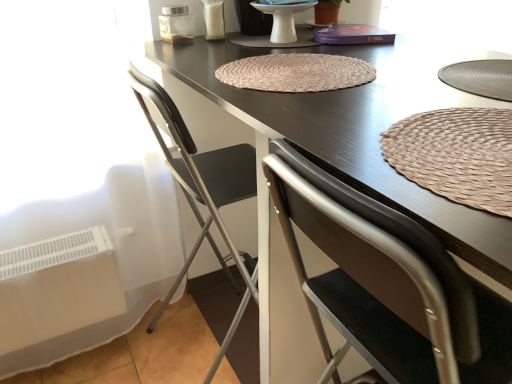
What do you see at coordinates (283, 20) in the screenshot?
I see `matte ceramic plate at center` at bounding box center [283, 20].

At what (x,y) coordinates should I click in order to perform the action: click on metallic gray chair at left. Please return your answer as a coordinate pair (x, y). Image resolution: width=512 pixels, height=384 pixels. Looking at the image, I should click on (203, 191).

Which is in front, brown woven mat at center, arranged as the 2th mat when viewed from the top, or dark brown wood table at center?

Positioned in front is dark brown wood table at center.

Is brown woven mat at center, which is the 1th mat from bottom to top, oriented away from dark brown wood table at center?

Correct, brown woven mat at center, which is the 1th mat from bottom to top, is looking away from dark brown wood table at center.

In terms of height, does brown woven mat at center, which is the 1th mat from bottom to top, look taller or shorter compared to dark brown wood table at center?

In the image, brown woven mat at center, which is the 1th mat from bottom to top, appears to be shorter than dark brown wood table at center.

Is brown woven mat at center, arranged as the 2th mat when viewed from the top, oriented away from matte ceramic plate at center?

No, brown woven mat at center, arranged as the 2th mat when viewed from the top,'s orientation is not away from matte ceramic plate at center.

How many degrees apart are the facing directions of brown woven mat at center, which is the 1th mat from bottom to top, and matte ceramic plate at center?

The facing directions of brown woven mat at center, which is the 1th mat from bottom to top, and matte ceramic plate at center are 2.3e-05 degrees apart.

Where is `round table behind the brown woven mat at center, which is the first mat from front to back`? Image resolution: width=512 pixels, height=384 pixels. round table behind the brown woven mat at center, which is the first mat from front to back is located at coordinates (283, 20).

In terms of size, does brown woven mat at center, which is the 1th mat from bottom to top, appear bigger or smaller than matte ceramic plate at center?

Clearly, brown woven mat at center, which is the 1th mat from bottom to top, is smaller in size than matte ceramic plate at center.

Does point (199, 67) come in front of point (276, 79)?

No.

From a real-world perspective, count 2nd mats upward from the dark brown wood table at center and point to it. Please provide its 2D coordinates.

[(296, 72)]

Could you tell me if dark brown wood table at center is facing brown woven mat at center, placed as the first mat when sorted from back to front?

No, dark brown wood table at center does not turn towards brown woven mat at center, placed as the first mat when sorted from back to front.

Considering the relative sizes of dark brown wood table at center and brown woven mat at center, placed as the first mat when sorted from back to front, in the image provided, is dark brown wood table at center smaller than brown woven mat at center, placed as the first mat when sorted from back to front,?

No, dark brown wood table at center is not smaller than brown woven mat at center, placed as the first mat when sorted from back to front.

Is dark brown wood table at center with metallic gray chair at left?

No.

Who is more distant, dark brown wood table at center or metallic gray chair at left?

metallic gray chair at left is behind.

Is dark brown wood table at center not within metallic gray chair at left?

dark brown wood table at center lies outside metallic gray chair at left's area.

Can you confirm if dark brown wood table at center is smaller than metallic gray chair at left?

Incorrect, dark brown wood table at center is not smaller in size than metallic gray chair at left.

Is point (286, 29) positioned behind point (242, 86)?

Yes, point (286, 29) is farther from viewer.

In the scene shown: Can you confirm if matte ceramic plate at center is shorter than brown woven mat at center, the second mat ordered from the bottom?

No, matte ceramic plate at center is not shorter than brown woven mat at center, the second mat ordered from the bottom.

Is matte ceramic plate at center far away from brown woven mat at center, placed as the first mat when sorted from back to front?

No, matte ceramic plate at center is not far from brown woven mat at center, placed as the first mat when sorted from back to front.

Between matte ceramic plate at center and brown woven mat at center, arranged as the first mat when viewed from the top, which one has smaller width?

Thinner between the two is matte ceramic plate at center.

From a real-world perspective, is matte ceramic plate at center under metallic gray chair at left?

No, from a real-world perspective, matte ceramic plate at center is not under metallic gray chair at left.

Is matte ceramic plate at center oriented towards metallic gray chair at left?

No.

Which is in front, matte ceramic plate at center or metallic gray chair at left?

metallic gray chair at left is closer to the camera.

Is matte ceramic plate at center at the left side of metallic gray chair at left?

No.

Does metallic gray chair at left turn towards matte ceramic plate at center?

Yes, metallic gray chair at left is oriented towards matte ceramic plate at center.

In the scene shown: Is metallic gray chair at left behind matte ceramic plate at center?

That is False.

Which point is more forward, (213, 188) or (292, 19)?

Point (213, 188)

Considering the positions of objects metallic gray chair at left and matte ceramic plate at center in the image provided, who is more to the right, metallic gray chair at left or matte ceramic plate at center?

matte ceramic plate at center is more to the right.

From a real-world perspective, count 1st mats upward from the dark brown wood table at center and point to it. Please provide its 2D coordinates.

[(456, 155)]

Where is `the 2nd mat below the matte ceramic plate at center (from the image's perspective)`? This screenshot has width=512, height=384. the 2nd mat below the matte ceramic plate at center (from the image's perspective) is located at coordinates (456, 155).

Estimate the real-world distances between objects in this image. Which object is closer to metallic gray chair at left, matte ceramic plate at center or brown woven mat at center, the second mat ordered from the bottom?

brown woven mat at center, the second mat ordered from the bottom, is positioned closer to the anchor metallic gray chair at left.

Estimate the real-world distances between objects in this image. Which object is further from brown woven mat at center, placed as the first mat when sorted from back to front, matte ceramic plate at center or brown woven mat at center, which appears as the 2th mat when viewed from the back?

Based on the image, brown woven mat at center, which appears as the 2th mat when viewed from the back, appears to be further to brown woven mat at center, placed as the first mat when sorted from back to front.

When comparing their distances from brown woven mat at center, the second mat viewed from the front, does dark brown wood table at center or metallic gray chair at left seem closer?

dark brown wood table at center lies closer to brown woven mat at center, the second mat viewed from the front, than the other object.

Estimate the real-world distances between objects in this image. Which object is further from matte ceramic plate at center, dark brown wood table at center or brown woven mat at center, the second mat ordered from the bottom?

dark brown wood table at center lies further to matte ceramic plate at center than the other object.

Which object lies further to the anchor point brown woven mat at center, the second mat viewed from the front, metallic gray chair at left or dark brown wood table at center?

metallic gray chair at left.

Based on their spatial positions, is metallic gray chair at left or matte ceramic plate at center further from brown woven mat at center, placed as the first mat when sorted from back to front?

metallic gray chair at left lies further to brown woven mat at center, placed as the first mat when sorted from back to front, than the other object.

Considering their positions, is matte ceramic plate at center positioned further to brown woven mat at center, arranged as the first mat when viewed from the top, than metallic gray chair at left?

metallic gray chair at left lies further to brown woven mat at center, arranged as the first mat when viewed from the top, than the other object.

Looking at the image, which one is located further to metallic gray chair at left, brown woven mat at center, arranged as the 2th mat when viewed from the top, or brown woven mat at center, the second mat viewed from the front?

brown woven mat at center, arranged as the 2th mat when viewed from the top.

The image size is (512, 384). What are the coordinates of `mat between brown woven mat at center, which appears as the 2th mat when viewed from the back, and metallic gray chair at left from front to back` in the screenshot? It's located at (296, 72).

Identify the location of chair between dark brown wood table at center and matte ceramic plate at center in the front-back direction. (x=203, y=191).

This screenshot has width=512, height=384. I want to click on chair positioned between brown woven mat at center, arranged as the 2th mat when viewed from the top, and matte ceramic plate at center from near to far, so click(203, 191).

At what (x,y) coordinates should I click in order to perform the action: click on mat between brown woven mat at center, arranged as the 2th mat when viewed from the top, and matte ceramic plate at center in the front-back direction. Please return your answer as a coordinate pair (x, y). This screenshot has height=384, width=512. Looking at the image, I should click on (296, 72).